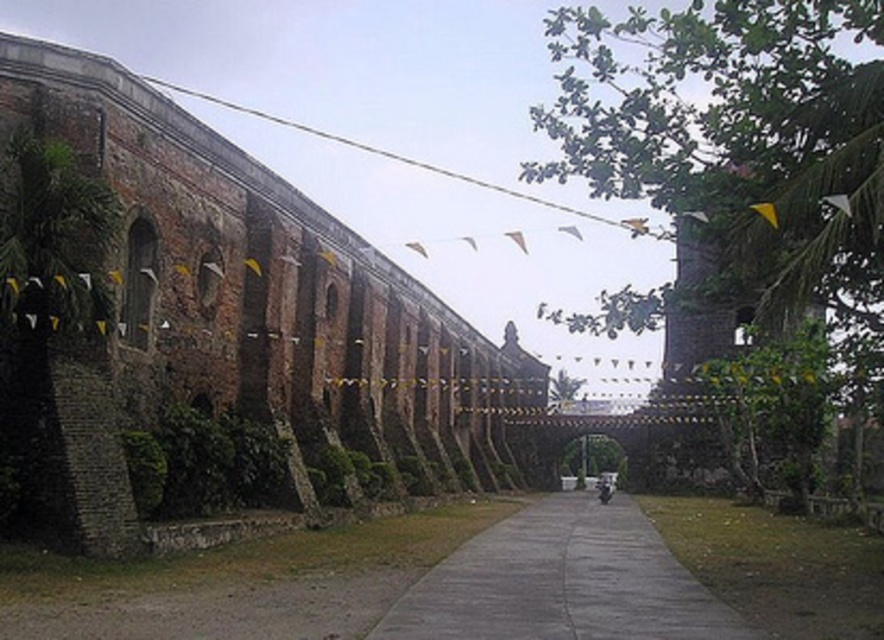
You are a photographer standing on the grassy area next to the pathway. You want to take a photo that includes both the brick wall at upper left and the silver metallic motorcycle at center. Which object should you adjust your camera angle to focus on first to ensure both are in frame?

The brick wall at upper left is located above the silver metallic motorcycle at center, so you should adjust your camera angle to focus on the brick wall at upper left first to ensure both are in frame.

You are a photographer standing at the entrance of the brick structure. You want to capture both the brick wall at upper left and the silver metallic motorcycle at center in a single frame. Based on their positions, which object should you adjust your camera angle to include first?

The brick wall at upper left is to the left of the silver metallic motorcycle at center, so you should adjust your camera angle to include the brick wall at upper left first since it is positioned further to the left.